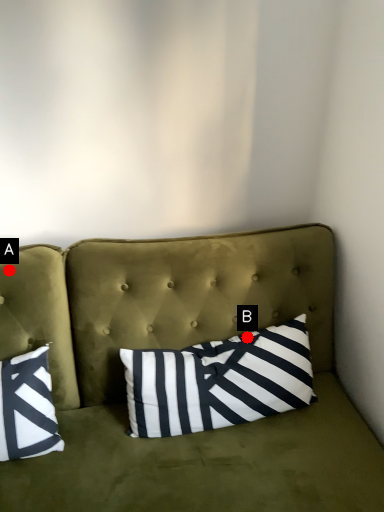
Question: Two points are circled on the image, labeled by A and B beside each circle. Which point is closer to the camera taking this photo?

Choices:
 (A) A is closer
 (B) B is closer

Answer: (A)